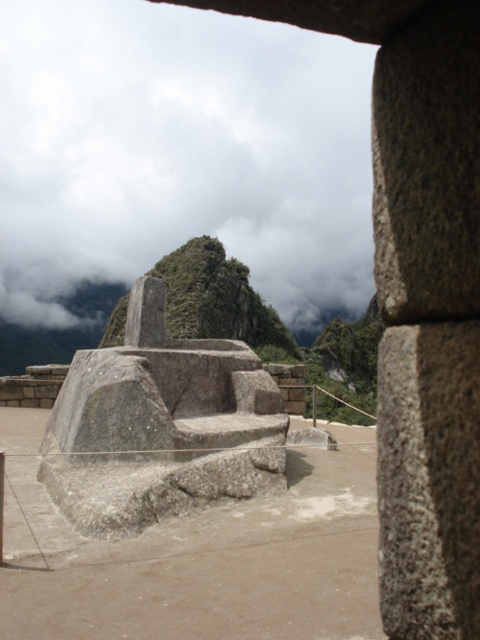
Can you confirm if white fluffy cloud at upper center is wider than gray stone seat at center?

Yes, white fluffy cloud at upper center is wider than gray stone seat at center.

Is white fluffy cloud at upper center to the left of gray stone seat at center from the viewer's perspective?

Correct, you'll find white fluffy cloud at upper center to the left of gray stone seat at center.

What are the coordinates of `white fluffy cloud at upper center` in the screenshot? It's located at (180, 154).